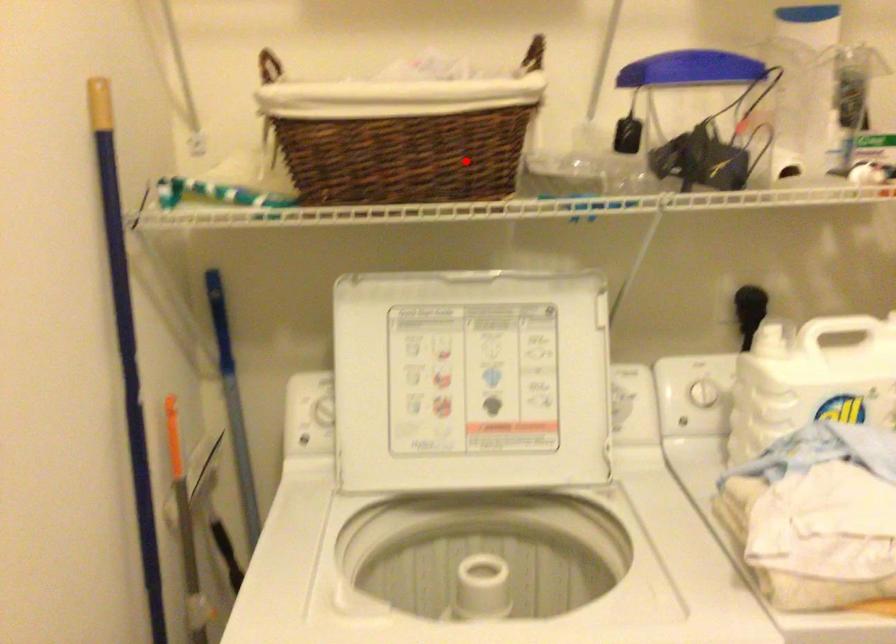
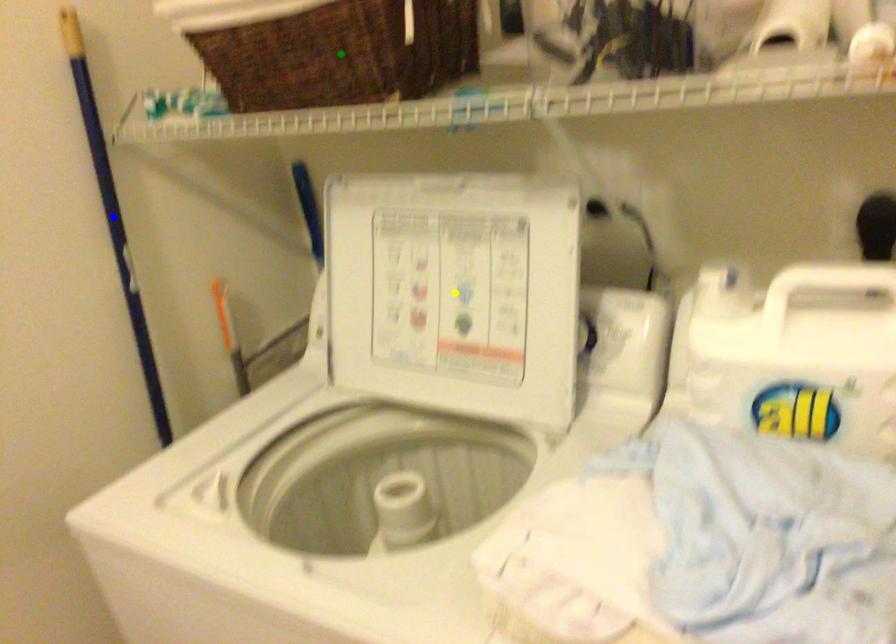
Question: I am providing you with two images of the same scene from different viewpoints. A red point is marked on the first image. You are given multiple points on the second image. In image 2, which mark is for the same physical point as the one in image 1?

Choices:
 (A) green point
 (B) yellow point
 (C) blue point

Answer: (A)